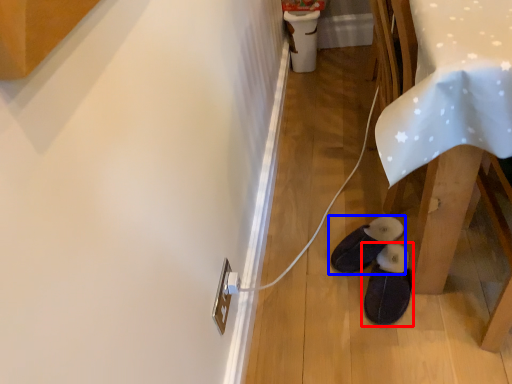
Question: Among these objects, which one is farthest to the camera, footwear (highlighted by a red box) or footwear (highlighted by a blue box)?

Choices:
 (A) footwear
 (B) footwear

Answer: (B)